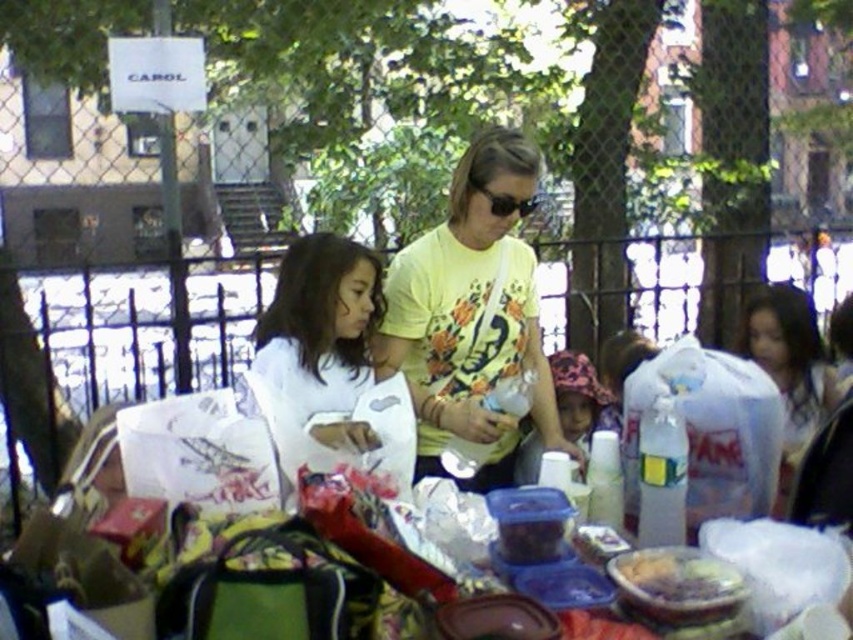
Question: Does yellow floral t-shirt at center appear on the right side of matte white shirt at right?

Choices:
 (A) yes
 (B) no

Answer: (B)

Question: From the image, what is the correct spatial relationship of yellow floral t-shirt at center in relation to white matte shirt at center?

Choices:
 (A) above
 (B) below

Answer: (A)

Question: Which point appears closest to the camera in this image?

Choices:
 (A) (799, 456)
 (B) (579, 451)

Answer: (A)

Question: Which point is farther to the camera?

Choices:
 (A) translucent plastic container at center
 (B) yellow floral t-shirt at center

Answer: (B)

Question: Is white matte shirt at center bigger than matte pink hat at center?

Choices:
 (A) yes
 (B) no

Answer: (A)

Question: Which point is closer to the camera?

Choices:
 (A) click(x=335, y=278)
 (B) click(x=397, y=333)
 (C) click(x=737, y=346)

Answer: (A)